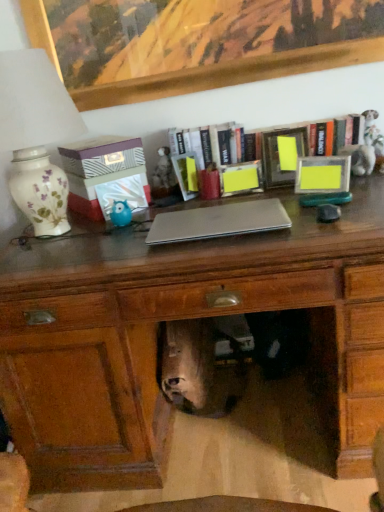
Where is `vacant area that is in front of white floral ceramic lamp at left`? vacant area that is in front of white floral ceramic lamp at left is located at coordinates (57, 261).